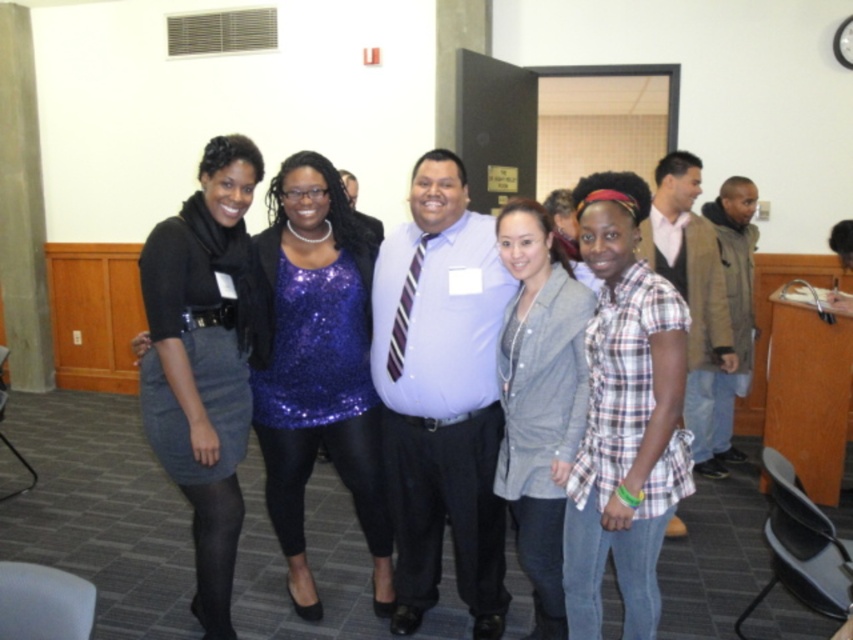
You are a photographer trying to adjust the lighting for a group photo. You notice a bright light source at point (316, 365). Which person in the group should you be cautious not to overexpose due to this light? Please refer to their clothing description.

The bright light source at point (316, 365) is on the sparkly blue top at center, so you should be cautious not to overexpose the person wearing the sparkly blue top at center.

You are a photographer trying to adjust the lighting for a group photo. You notice the denim jacket at center and the brown fuzzy jacket at right. Which jacket might require more careful lighting to avoid glare, and why?

The denim jacket at center might require more careful lighting to avoid glare because it is thinner and could reflect light more than the brown fuzzy jacket at right, which has a thicker material that absorbs light better.

You are a photographer trying to capture a clear shot of the plaid cotton shirt at center and the sparkly blue top at center. Which of the two is blocking the other from view?

The plaid cotton shirt at center is behind the sparkly blue top at center, so the sparkly blue top at center is blocking the plaid cotton shirt at center from view.